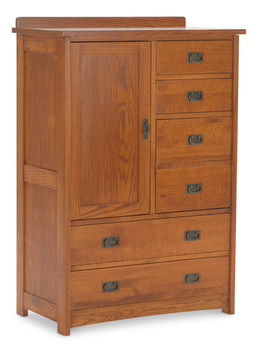
What are the coordinates of `wooden furniture` in the screenshot? It's located at (114, 186).